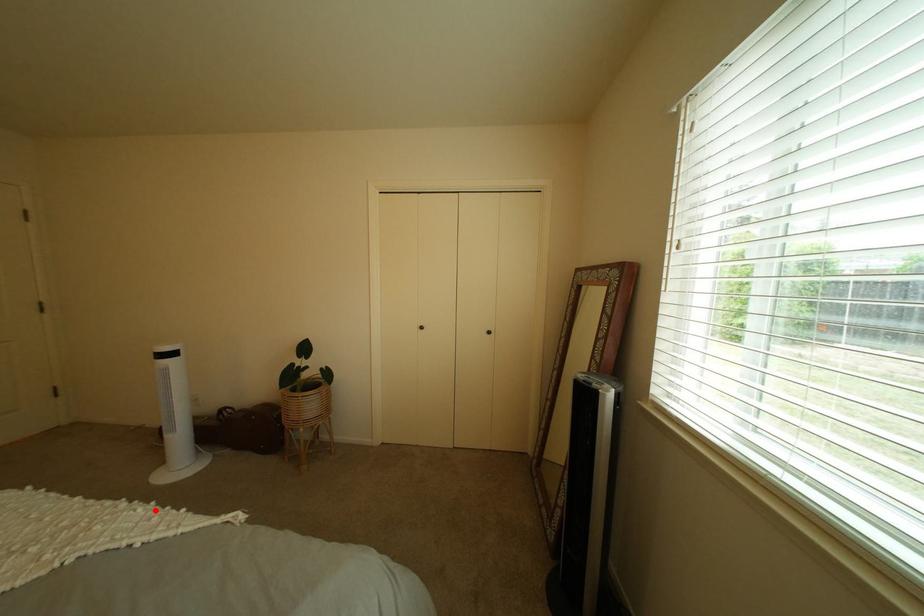
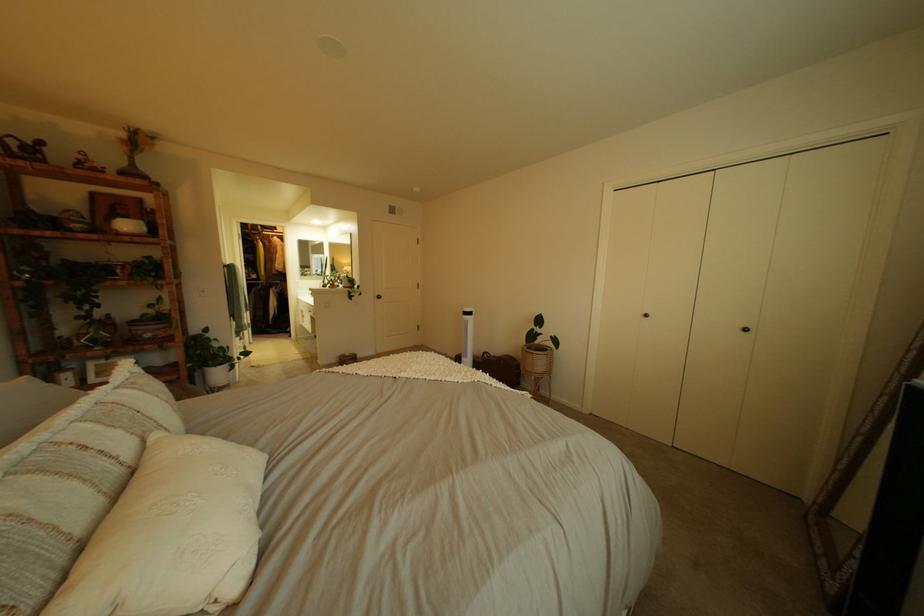
Locate, in the second image, the point that corresponds to the highlighted location in the first image.

(504, 376)